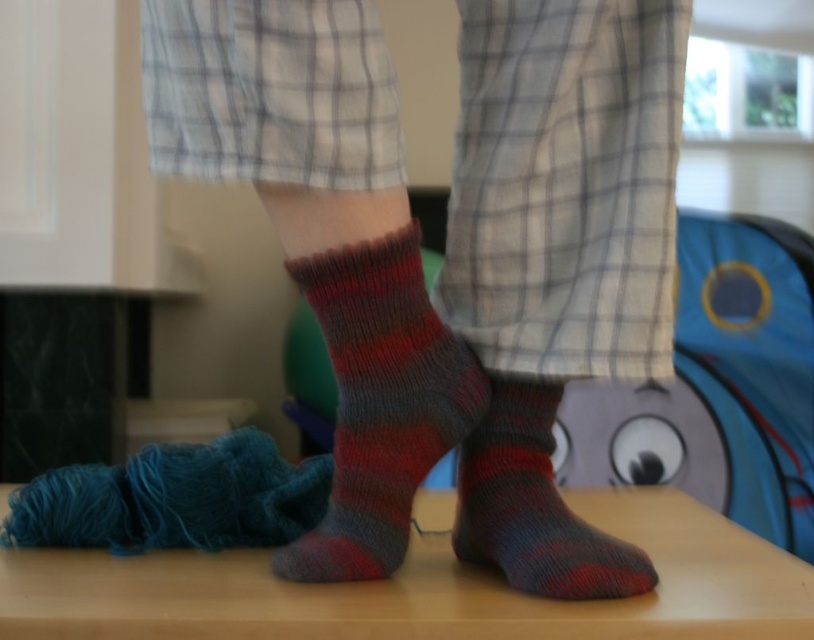
You are a tailor trying to determine which sock to use for a project. You have two options in the image. Which one is larger between the knitted wool socks at center and the knitted wool sock at center?

The knitted wool socks at center is bigger than the knitted wool sock at center.

You are organizing a sock drawer and notice two items in the image. Which one is positioned more to the left between the knitted wool socks at center and the knitted wool sock at center?

The knitted wool socks at center is positioned more to the left than the knitted wool sock at center.